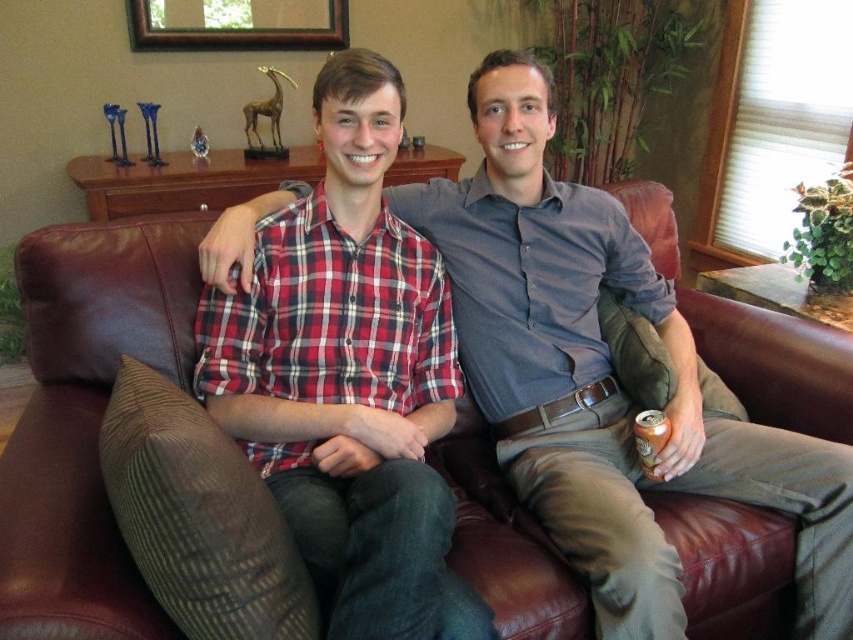
Question: Estimate the real-world distances between objects in this image. Which object is farther from the red plaid shirt at center?

Choices:
 (A) leather couch at center
 (B) brown wooden picture frame at upper center

Answer: (B)

Question: Which point is closer to the camera taking this photo?

Choices:
 (A) (273, 477)
 (B) (178, 42)
 (C) (660, 500)

Answer: (A)

Question: Does red plaid shirt at center have a greater width compared to brown wooden picture frame at upper center?

Choices:
 (A) no
 (B) yes

Answer: (A)

Question: Is leather couch at center wider than brown wooden picture frame at upper center?

Choices:
 (A) no
 (B) yes

Answer: (A)

Question: Based on their relative distances, which object is farther from the brown wooden picture frame at upper center?

Choices:
 (A) red plaid shirt at center
 (B) leather couch at center

Answer: (A)

Question: Is leather couch at center to the right of red plaid shirt at center from the viewer's perspective?

Choices:
 (A) no
 (B) yes

Answer: (A)